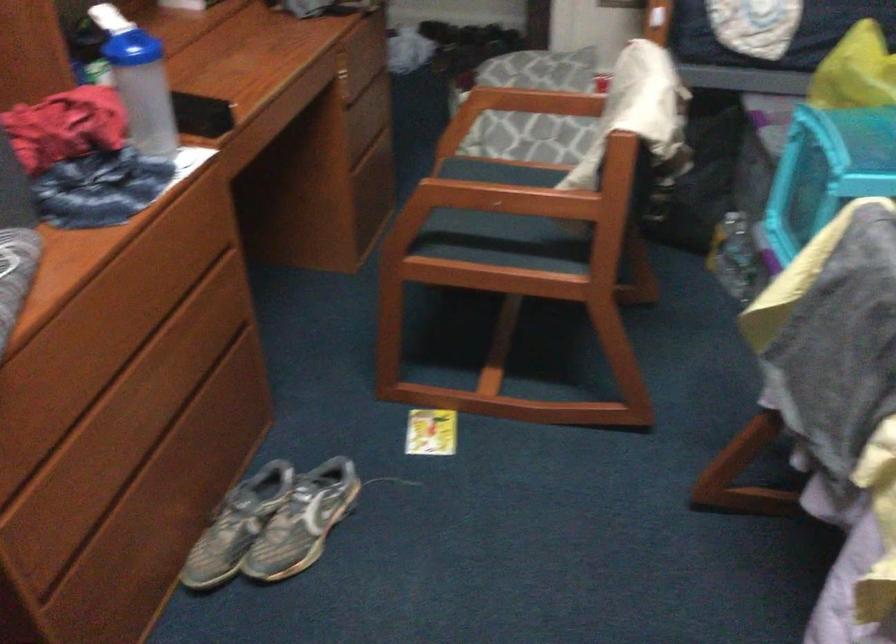
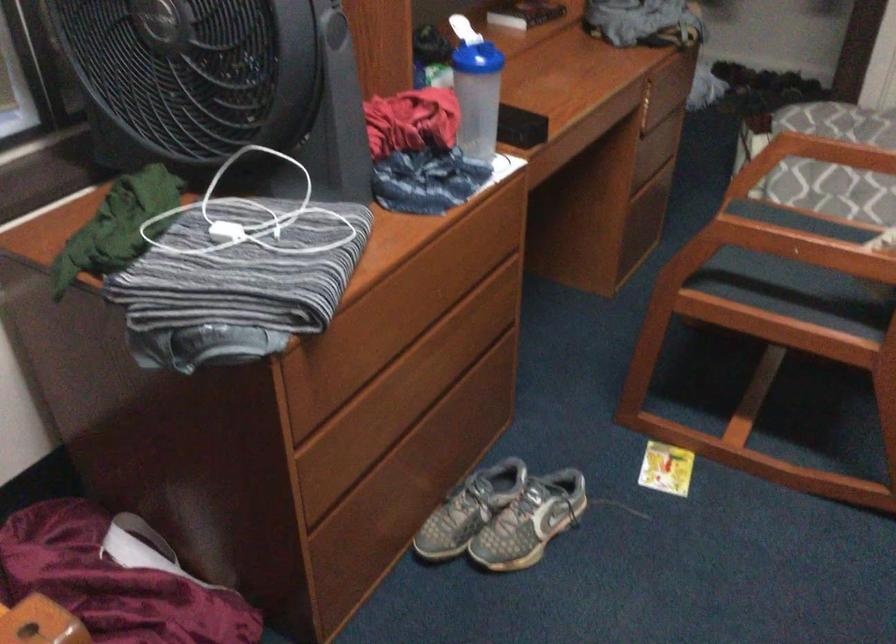
Question: I am providing you with two images of the same scene from different viewpoints. Which of the following objects are not visible in image2?

Choices:
 (A) gray sneaker
 (B) brown drawer handle
 (C) small yellow card
 (D) none of these

Answer: (D)